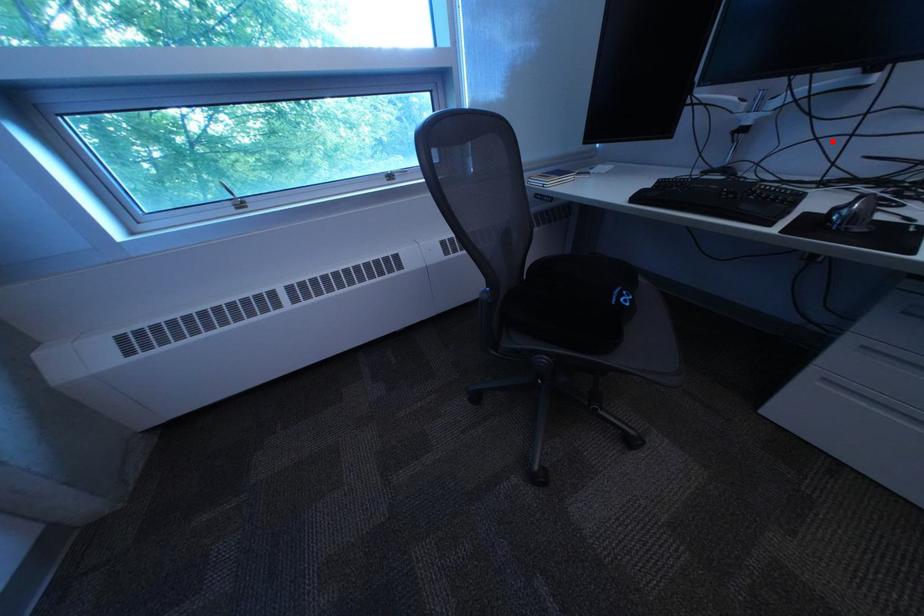
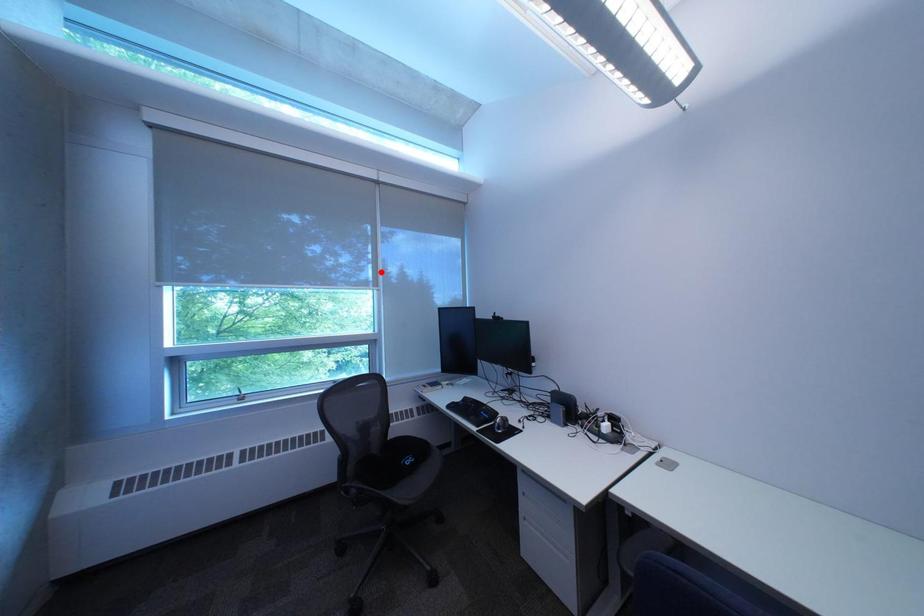
I am providing you with two images of the same scene from different viewpoints. A red point is marked on the first image and another point is marked on the second image. Does the point marked in image1 correspond to the same location as the one in image2?

No